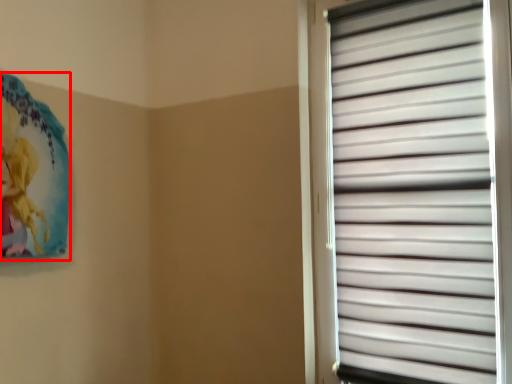
Question: From the image's perspective, what is the correct spatial positioning of art (annotated by the red box) in reference to window blind?

Choices:
 (A) below
 (B) above

Answer: (B)